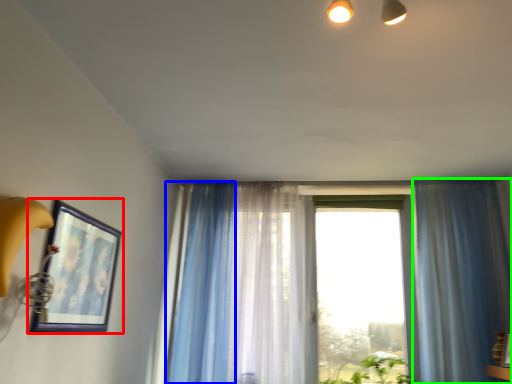
Question: Which object is the closest to the picture frame (highlighted by a red box)? Choose among these: curtain (highlighted by a blue box) or curtain (highlighted by a green box).

Choices:
 (A) curtain
 (B) curtain

Answer: (A)